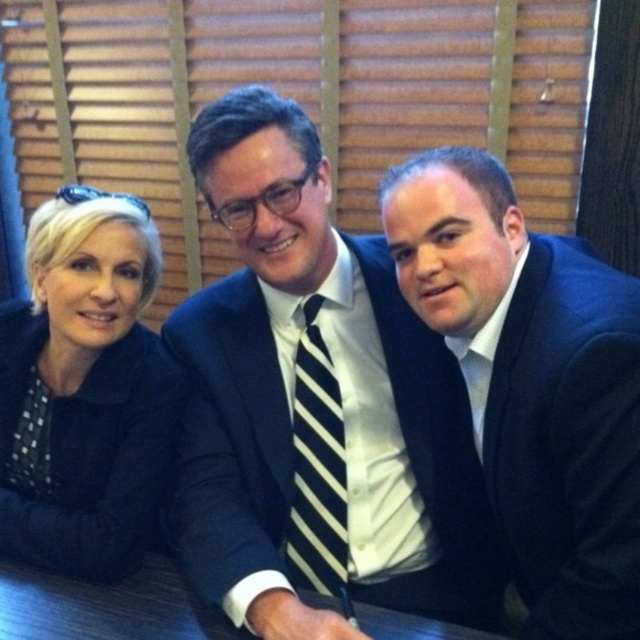
Based on the coordinates provided, which object is located at point (x=316, y=403)?

The point (x=316, y=403) marks the dark blue suit at center.

You are standing in a room with two points marked on the floor. You see point labeled as point (444, 442) and another labeled as point (552, 435). Which point is closer to you?

Point (552, 435) is closer to you because it is in front of point (444, 442).

You are standing in a professional meeting room and see the matte black suit at right and the black dotted shirt at left. Which one is nearer to you?

The matte black suit at right is closer to the viewer than the black dotted shirt at left.